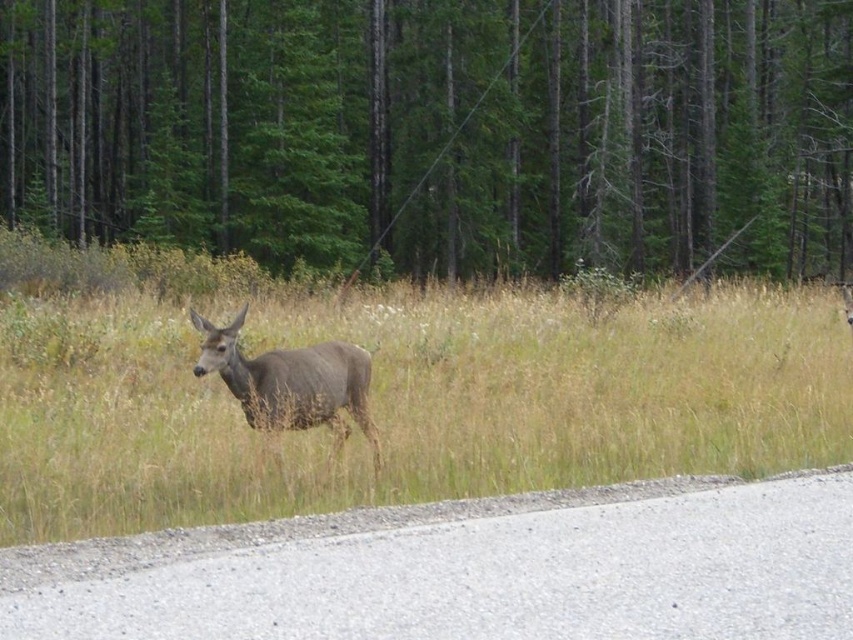
Question: Which point is closer to the camera?

Choices:
 (A) (311, 400)
 (B) (57, 320)

Answer: (A)

Question: Can you confirm if green matte tree at center is thinner than brown grass at center?

Choices:
 (A) no
 (B) yes

Answer: (A)

Question: Is brown grass at center closer to camera compared to brown matte deer at center?

Choices:
 (A) yes
 (B) no

Answer: (A)

Question: Among these objects, which one is nearest to the camera?

Choices:
 (A) brown matte deer at center
 (B) brown grass at center
 (C) green matte tree at center

Answer: (B)

Question: Can you confirm if green matte tree at center is smaller than brown matte deer at center?

Choices:
 (A) yes
 (B) no

Answer: (B)

Question: Among these objects, which one is farthest from the camera?

Choices:
 (A) brown grass at center
 (B) green matte tree at center
 (C) brown matte deer at center

Answer: (B)